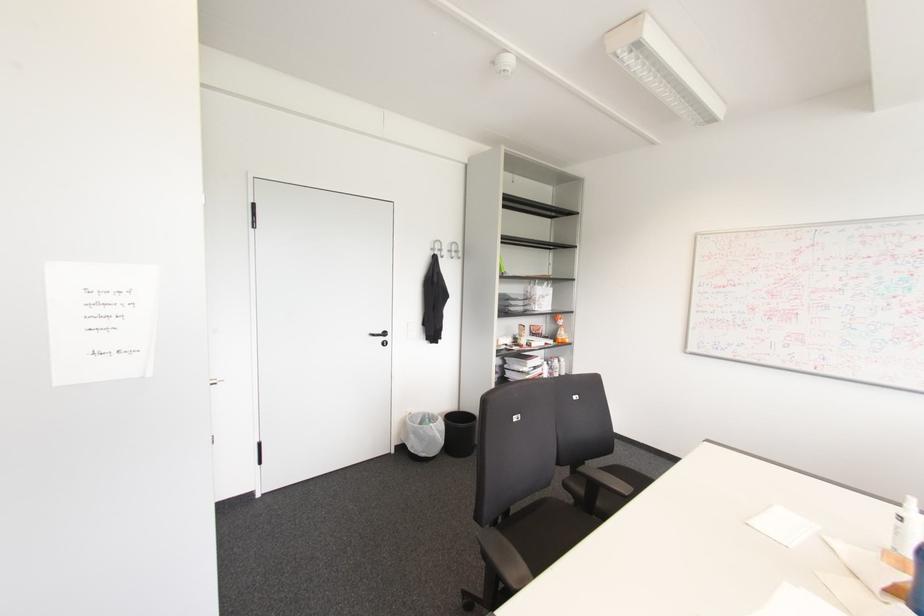
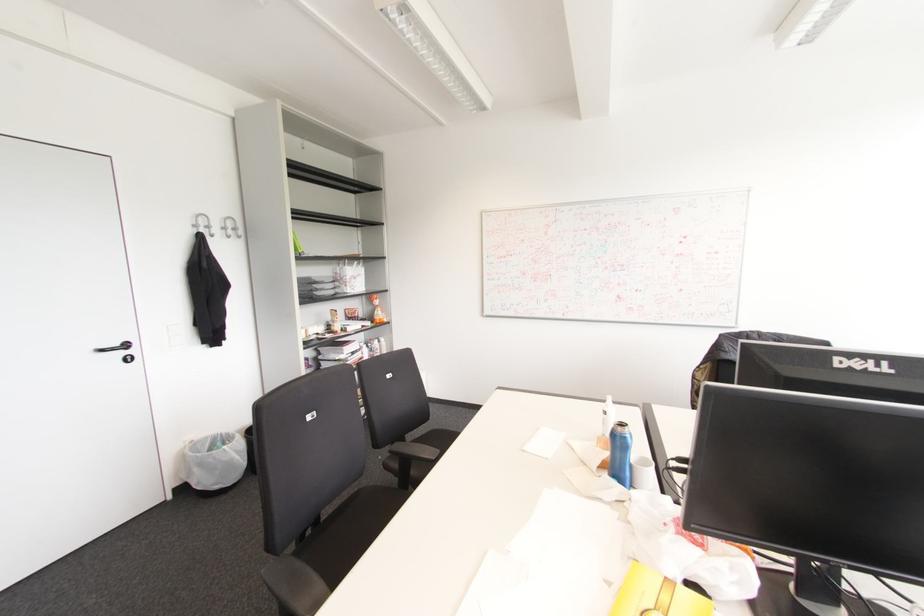
In the second image, find the point that corresponds to point 432,249 in the first image.

(195, 225)